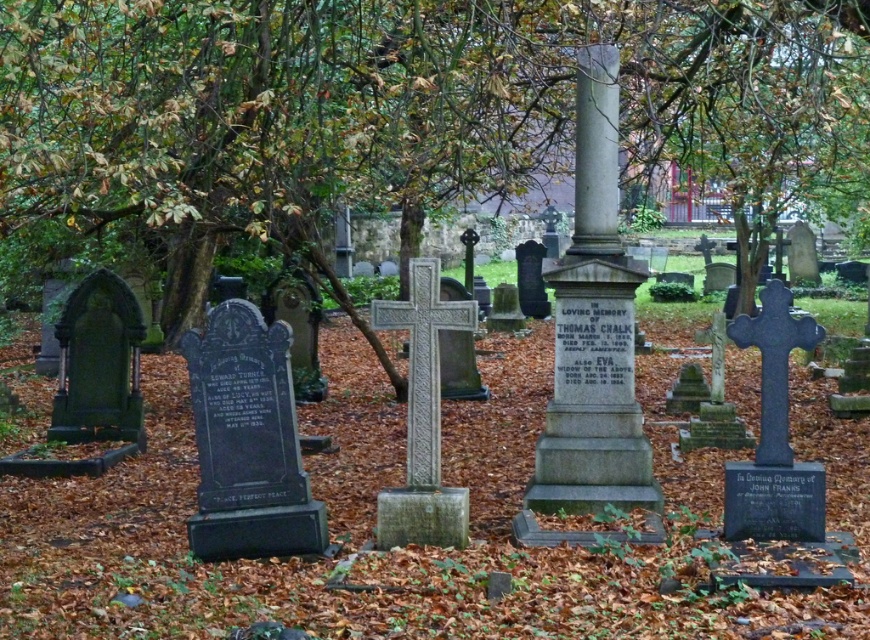
Can you confirm if green leafy tree at center is positioned to the left of gray stone column at center?

Indeed, green leafy tree at center is positioned on the left side of gray stone column at center.

The height and width of the screenshot is (640, 870). What do you see at coordinates (382, 102) in the screenshot?
I see `green leafy tree at center` at bounding box center [382, 102].

In order to click on green leafy tree at center in this screenshot , I will do pos(382,102).